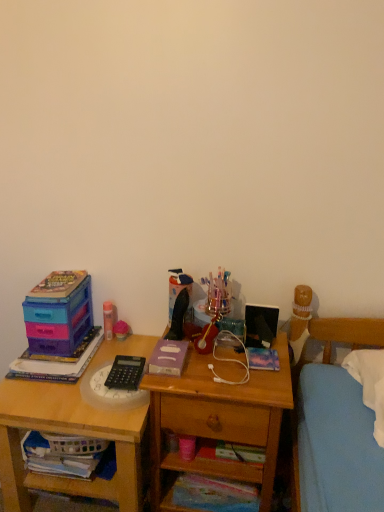
Question: Is matte plastic toy at center further to camera compared to pink matte glue stick at upper left, the 1th stationery viewed from the left?

Choices:
 (A) no
 (B) yes

Answer: (B)

Question: Considering the relative sizes of matte plastic toy at center and pink matte glue stick at upper left, the 1th stationery viewed from the left, in the image provided, is matte plastic toy at center taller than pink matte glue stick at upper left, the 1th stationery viewed from the left,?

Choices:
 (A) yes
 (B) no

Answer: (B)

Question: Does matte plastic toy at center have a larger size compared to pink matte glue stick at upper left, the 2th stationery in the front-to-back sequence?

Choices:
 (A) no
 (B) yes

Answer: (A)

Question: From the image's perspective, does matte plastic toy at center appear lower than pink matte glue stick at upper left, which is the second stationery from bottom to top?

Choices:
 (A) no
 (B) yes

Answer: (B)

Question: Can you confirm if matte plastic toy at center is positioned to the right of pink matte glue stick at upper left, which is the first stationery from back to front?

Choices:
 (A) yes
 (B) no

Answer: (A)

Question: Considering the positions of point (175, 430) and point (56, 325), is point (175, 430) closer or farther from the camera than point (56, 325)?

Choices:
 (A) farther
 (B) closer

Answer: (B)

Question: Is wooden drawer at lower center wider or thinner than matte plastic storage box at left?

Choices:
 (A) thin
 (B) wide

Answer: (A)

Question: From the image's perspective, is wooden drawer at lower center above or below matte plastic storage box at left?

Choices:
 (A) above
 (B) below

Answer: (B)

Question: Based on their sizes in the image, would you say wooden drawer at lower center is bigger or smaller than matte plastic storage box at left?

Choices:
 (A) big
 (B) small

Answer: (B)

Question: From a real-world perspective, is metallic blue book at center, which appears as the 2th book when viewed from the top, above or below multicolored paper book at lower center, the second book from the right?

Choices:
 (A) below
 (B) above

Answer: (B)

Question: From the image's perspective, is metallic blue book at center, which ranks as the 1th book in right-to-left order, above or below multicolored paper book at lower center, placed as the 5th book when sorted from top to bottom?

Choices:
 (A) above
 (B) below

Answer: (A)

Question: Based on their sizes in the image, would you say metallic blue book at center, which ranks as the 1th book in right-to-left order, is bigger or smaller than multicolored paper book at lower center, the second book from the right?

Choices:
 (A) small
 (B) big

Answer: (A)

Question: Visually, is metallic blue book at center, which appears as the 2th book when viewed from the top, positioned to the left or to the right of multicolored paper book at lower center, placed as the 5th book when sorted from top to bottom?

Choices:
 (A) right
 (B) left

Answer: (A)

Question: In terms of height, does wooden desk at left look taller or shorter compared to black plastic calculator at center, the 2th stationery when ordered from top to bottom?

Choices:
 (A) short
 (B) tall

Answer: (B)

Question: From a real-world perspective, is wooden desk at left physically located above or below black plastic calculator at center, the 2th stationery when ordered from top to bottom?

Choices:
 (A) below
 (B) above

Answer: (A)